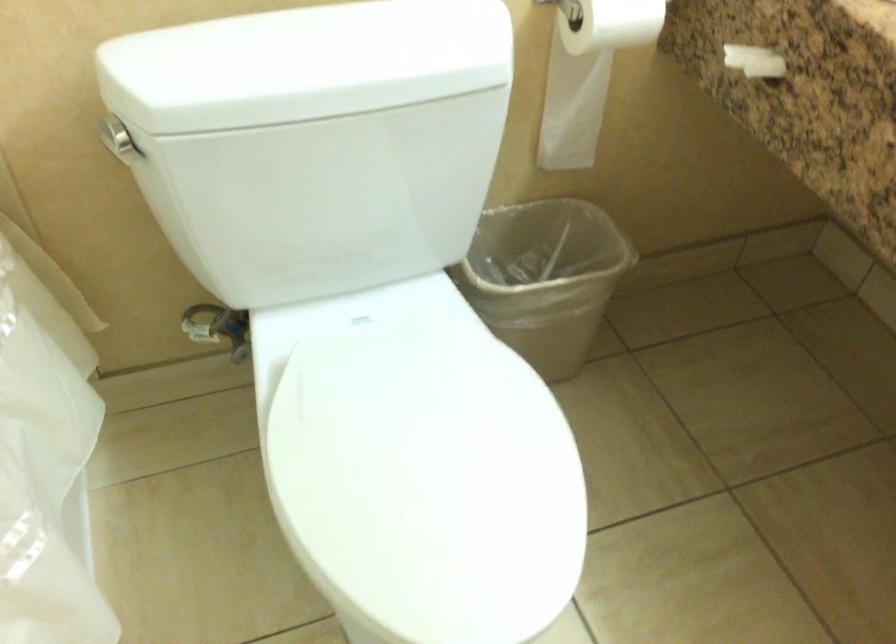
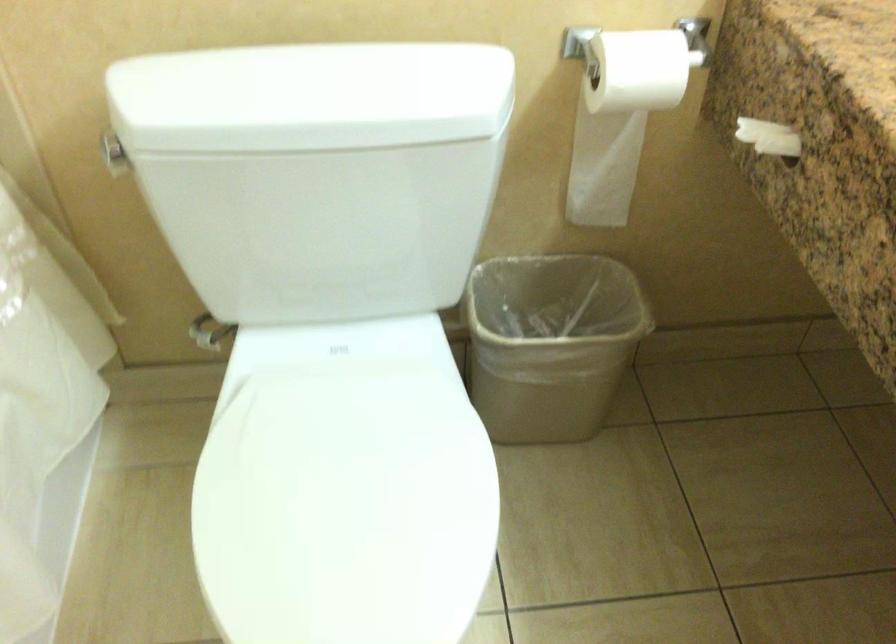
Question: Which direction would the cameraman need to move to produce the second image? Reply with the corresponding letter.

Choices:
 (A) Left
 (B) Right
 (C) Forward
 (D) Backward

Answer: (B)